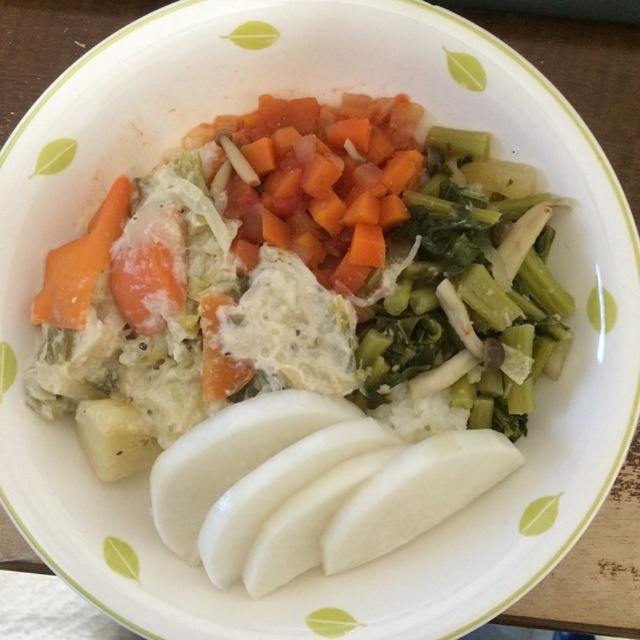
You are a food critic evaluating this dish. Based on the description, which object on the plate is larger in size between the green leafy vegetable at center and the diced orange carrot at center?

The green leafy vegetable at center is bigger than the diced orange carrot at center.

From the picture: You are a chef arranging vegetables on a plate. You have a diced orange carrot at center and an orange matte carrot at left. If you want to place a garnish exactly halfway between them, where should you put it?

The diced orange carrot at center and the orange matte carrot at left are 12.78 inches apart. Placing the garnish halfway would mean positioning it 6.39 inches from each carrot.

You are a food critic examining the plate. You notice two carrot pieces labeled as diced orange carrot at center and orange matte carrot at left. Which carrot piece is located to the right of the other?

The diced orange carrot at center is positioned on the right side of the orange matte carrot at left, so the diced orange carrot at center is to the right of the orange matte carrot at left.